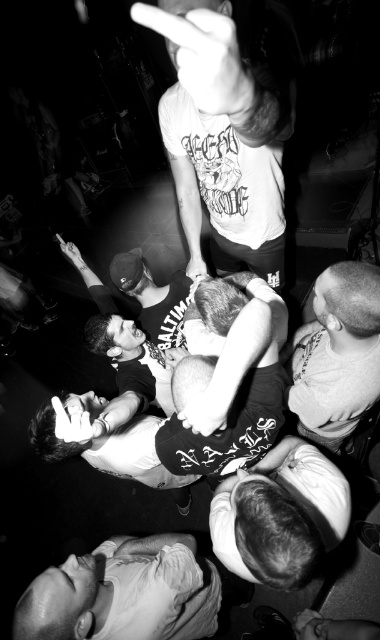
Question: Among these points, which one is nearest to the camera?

Choices:
 (A) click(x=118, y=557)
 (B) click(x=254, y=538)
 (C) click(x=329, y=307)

Answer: (B)

Question: Among these points, which one is farthest from the camera?

Choices:
 (A) (275, 557)
 (B) (204, 36)
 (C) (123, 586)
 (D) (302, 397)

Answer: (D)

Question: Does dark gray t-shirt at center appear under smooth gray shirt at center?

Choices:
 (A) no
 (B) yes

Answer: (B)

Question: Does white t-shirt at upper center lie behind smooth gray shirt at center?

Choices:
 (A) yes
 (B) no

Answer: (B)

Question: Among these points, which one is farthest from the camera?

Choices:
 (A) (207, 353)
 (B) (234, 144)

Answer: (A)

Question: Is smooth white shirt at lower left to the right of smooth white shirt at lower center from the viewer's perspective?

Choices:
 (A) yes
 (B) no

Answer: (B)